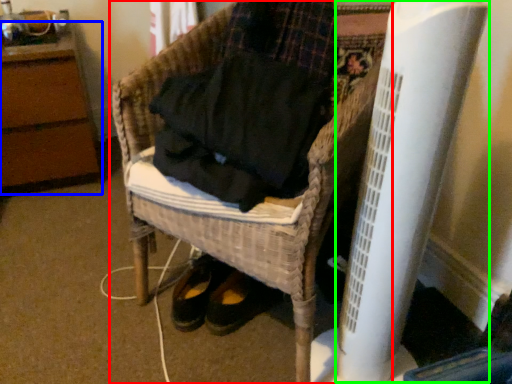
Question: Which object is the closest to the furniture (highlighted by a red box)? Choose among these: furniture (highlighted by a blue box) or radiator (highlighted by a green box).

Choices:
 (A) furniture
 (B) radiator

Answer: (B)